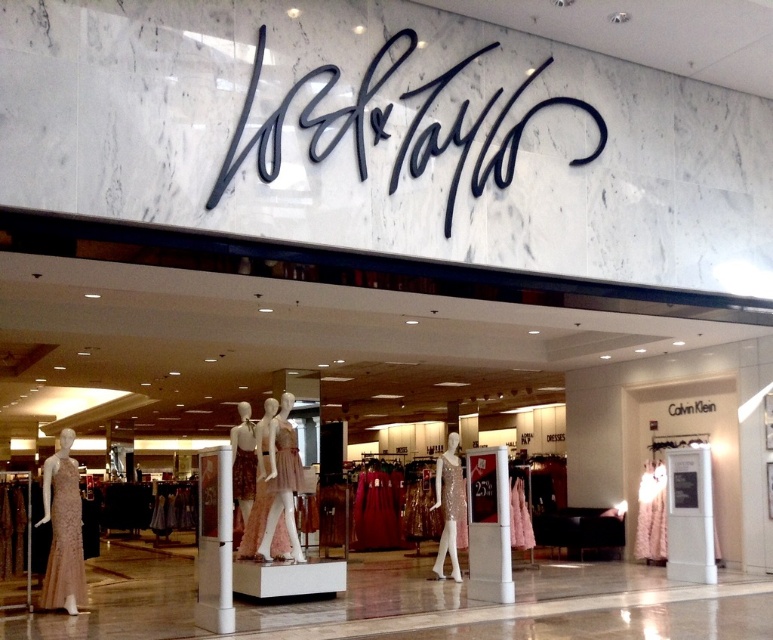
In the scene shown: Can you confirm if satin gold dress at left is positioned to the right of shiny gold dress at right?

In fact, satin gold dress at left is to the left of shiny gold dress at right.

Can you confirm if satin gold dress at left is shorter than shiny gold dress at right?

In fact, satin gold dress at left may be taller than shiny gold dress at right.

Which is in front, point (72, 522) or point (661, 506)?

Point (72, 522)

The image size is (773, 640). In order to click on satin gold dress at left in this screenshot , I will do `click(63, 540)`.

Between point (393, 182) and point (50, 520), which one is positioned in front?

Point (393, 182) is more forward.

Can you confirm if black script at center is taller than satin gold dress at left?

Yes, black script at center is taller than satin gold dress at left.

Is point (386, 109) behind point (60, 579)?

No, it is in front of (60, 579).

This screenshot has height=640, width=773. What are the coordinates of `black script at center` in the screenshot? It's located at (305, 116).

Which is in front, point (247, 99) or point (646, 529)?

Point (247, 99) is in front.

Between black script at center and shiny gold dress at right, which one is positioned lower?

shiny gold dress at right is lower down.

Between point (274, 147) and point (659, 513), which one is positioned behind?

Positioned behind is point (659, 513).

I want to click on black script at center, so click(305, 116).